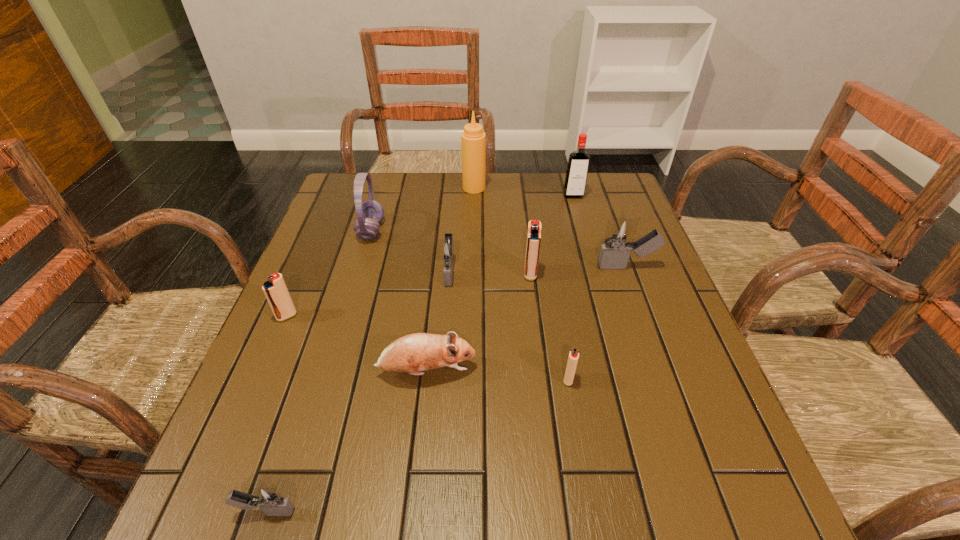
Find the location of a particular element. The height and width of the screenshot is (540, 960). free location that satisfies the following two spatial constraints: 1. on the front side of the rightmost gray igniter; 2. at the face of the hamster is located at coordinates (664, 372).

You are a GUI agent. You are given a task and a screenshot of the screen. Output one action in this format:
    pyautogui.click(x=<x>, y=<y>)
    Task: Click on the vacant area in the image that satisfies the following two spatial constraints: 1. on the headband and ear cups of the headset; 2. on the back side of the second nearest igniter
    The height and width of the screenshot is (540, 960).
    Given the screenshot: What is the action you would take?
    pyautogui.click(x=326, y=380)

Find the location of a particular element. This screenshot has width=960, height=540. vacant space that satisfies the following two spatial constraints: 1. at the face of the nearest red igniter; 2. on the left side of the brown hamster is located at coordinates (425, 380).

Where is `vacant area in the image that satisfies the following two spatial constraints: 1. on the headband and ear cups of the biggest gray igniter; 2. on the right side of the headset`? Image resolution: width=960 pixels, height=540 pixels. vacant area in the image that satisfies the following two spatial constraints: 1. on the headband and ear cups of the biggest gray igniter; 2. on the right side of the headset is located at coordinates (360, 267).

Where is `blank area in the image that satisfies the following two spatial constraints: 1. on the front and back of the vodka; 2. on the headband and ear cups of the third farthest object`? The width and height of the screenshot is (960, 540). blank area in the image that satisfies the following two spatial constraints: 1. on the front and back of the vodka; 2. on the headband and ear cups of the third farthest object is located at coordinates (583, 230).